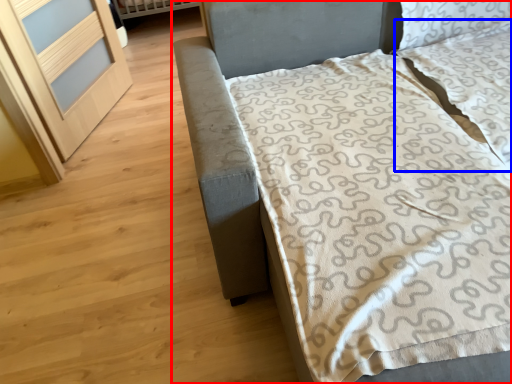
Question: Which object appears farthest to the camera in this image, bed (highlighted by a red box) or pillow (highlighted by a blue box)?

Choices:
 (A) bed
 (B) pillow

Answer: (B)